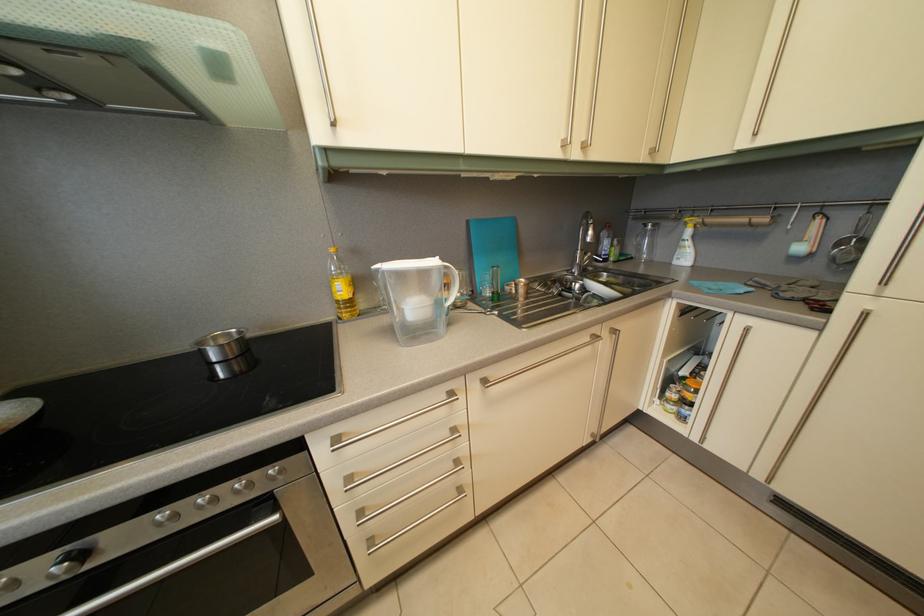
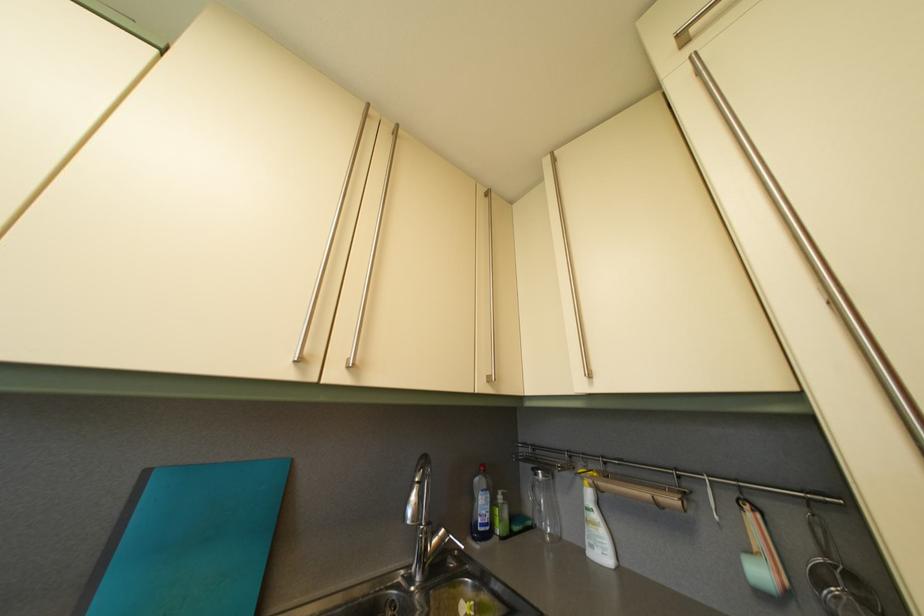
Where in the second image is the point corresponding to [598,262] from the first image?

(451, 539)